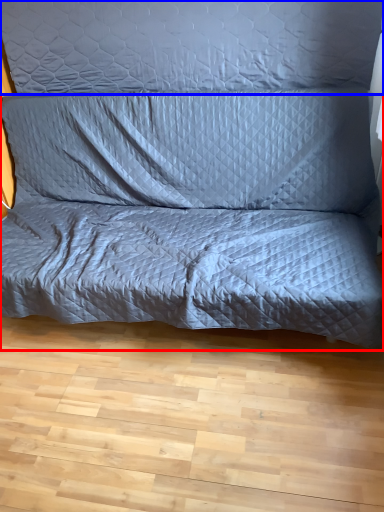
Question: Which object appears farthest to the camera in this image, studio couch (highlighted by a red box) or pillow (highlighted by a blue box)?

Choices:
 (A) studio couch
 (B) pillow

Answer: (B)